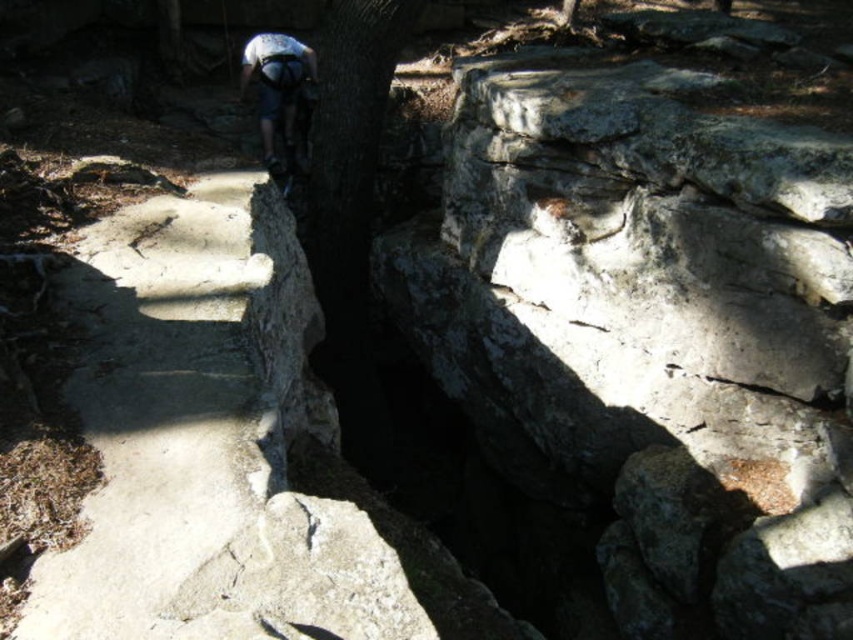
Does white concrete steps at center have a lesser height compared to white matte helmet at upper center?

Incorrect, white concrete steps at center's height does not fall short of white matte helmet at upper center's.

Who is shorter, white concrete steps at center or white matte helmet at upper center?

Standing shorter between the two is white matte helmet at upper center.

Identify the location of white concrete steps at center. The image size is (853, 640). (173, 403).